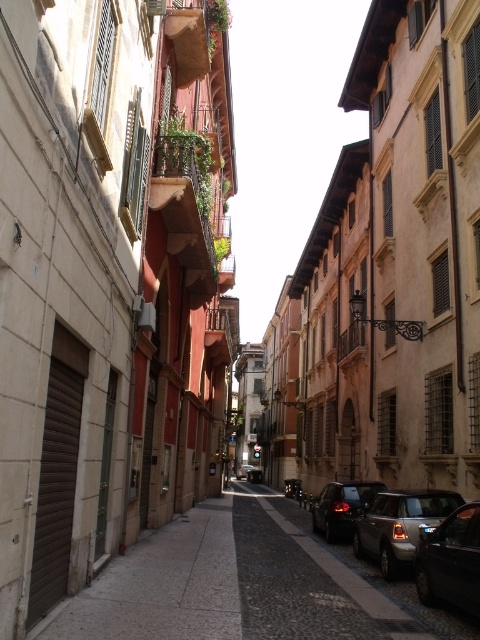
You are standing at the entrance of the historic European city street. You see the cobblestone pavement at center. If you were to walk straight ahead, would you be moving towards the parked cars on the right side of the street?

The cobblestone pavement at center is located at point 0.914 on the x axis and 0.515 on the y axis. Since the parked cars are on the right side of the street, walking straight ahead along the pavement would keep you on the center path, not directly towards the parked cars. However, depending on the street layout, you might be moving parallel to the parked cars on the right side.

You are a tourist standing on the cobblestone street in the historic European city. You see two points marked on the map. The first point is at coordinates point (105, 618) and the second is at point (312, 529). If you want to visit both points, which point should you visit first to ensure you don

Answer: Point (105, 618) is in front of point (312, 529), so you should visit point (105, 618) first before moving to the second point.